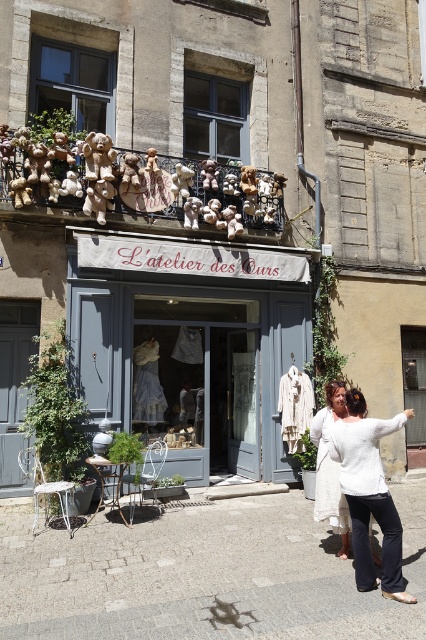
Does point (85, 113) lie in front of point (333, 477)?

No.

Is matte glass window at upper left bigger than white cotton dress at center?

Yes.

You are a GUI agent. You are given a task and a screenshot of the screen. Output one action in this format:
    pyautogui.click(x=<x>, y=<y>)
    Task: Click on the matte glass window at upper left
    The height and width of the screenshot is (640, 426).
    Given the screenshot: What is the action you would take?
    pyautogui.click(x=72, y=83)

Who is higher up, white cotton sweater at center or matte glass window at upper left?

Positioned higher is matte glass window at upper left.

Measure the distance between white cotton sweater at center and matte glass window at upper left.

white cotton sweater at center and matte glass window at upper left are 5.78 meters apart.

Find the location of a particular element. white cotton sweater at center is located at coordinates (370, 493).

Find the location of a particular element. white cotton sweater at center is located at coordinates click(370, 493).

Which is above, matte gray storefront at center or matte glass window at upper left?

matte glass window at upper left is higher up.

Is point (184, 467) in front of point (89, 90)?

Yes, it is in front of point (89, 90).

In order to click on matte gray storefront at center in this screenshot , I will do `click(190, 349)`.